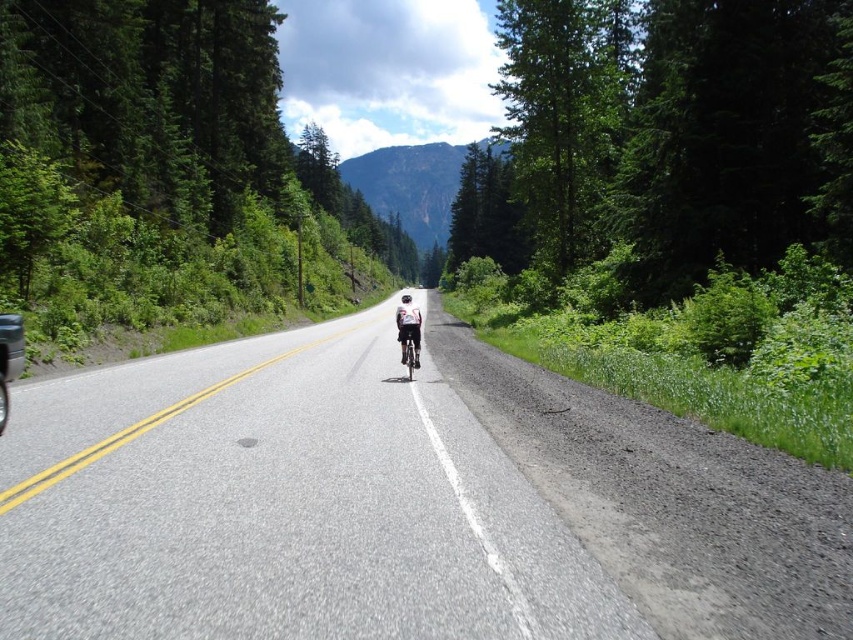
Which is more to the right, gray asphalt road at center or shiny silver bicycle at center?

From the viewer's perspective, shiny silver bicycle at center appears more on the right side.

Is point (502, 560) closer to camera compared to point (405, 336)?

Yes, it is in front of point (405, 336).

Is point (54, 483) positioned behind point (415, 358)?

That is False.

At what (x,y) coordinates should I click in order to perform the action: click on gray asphalt road at center. Please return your answer as a coordinate pair (x, y). The image size is (853, 640). Looking at the image, I should click on (281, 504).

Can you confirm if gray asphalt road at center is thinner than gravelly dirt path at right?

Incorrect, gray asphalt road at center's width is not less than gravelly dirt path at right's.

Can you confirm if gray asphalt road at center is bigger than gravelly dirt path at right?

Yes.

Does point (393, 385) come farther from viewer compared to point (494, 428)?

That is True.

Image resolution: width=853 pixels, height=640 pixels. Find the location of `gray asphalt road at center`. gray asphalt road at center is located at coordinates (281, 504).

Does shiny silver bicycle at center appear on the left side of white matte bicycle helmet at center?

Incorrect, shiny silver bicycle at center is not on the left side of white matte bicycle helmet at center.

Locate an element on the screen. The height and width of the screenshot is (640, 853). shiny silver bicycle at center is located at coordinates point(409,348).

Is point (410, 380) farther from camera compared to point (403, 301)?

That is False.

I want to click on shiny silver bicycle at center, so click(x=409, y=348).